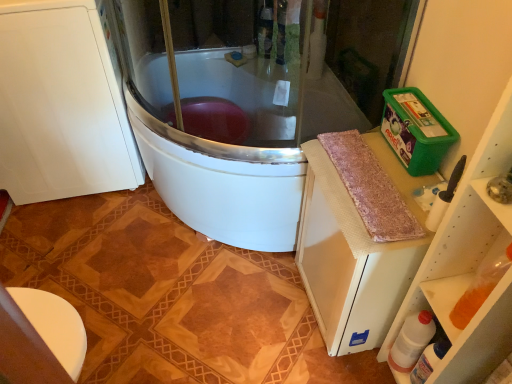
The height and width of the screenshot is (384, 512). Find the location of `free space above pink shaggy rug at right (from a real-world perspective)`. free space above pink shaggy rug at right (from a real-world perspective) is located at coordinates 373,178.